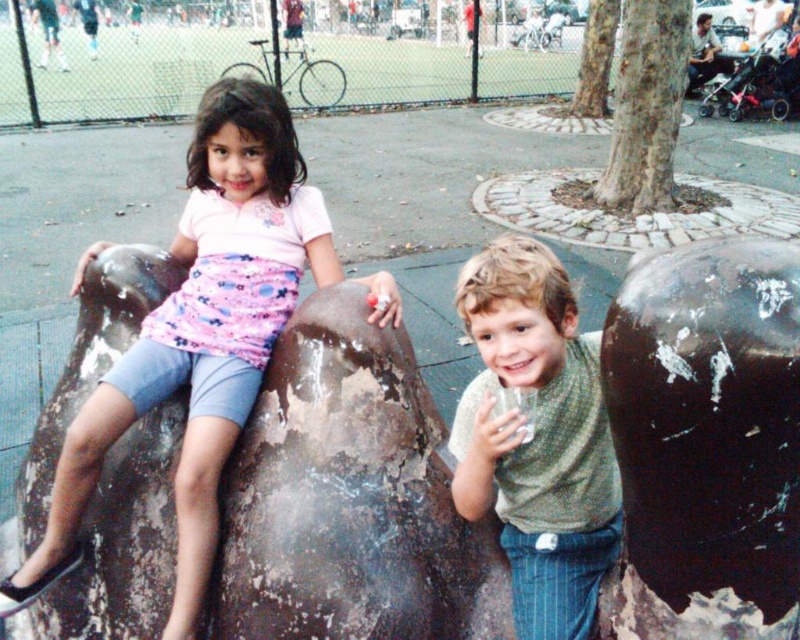
Question: Can you confirm if rusty metal sculpture at center is smaller than matte pink shirt at upper left?

Choices:
 (A) no
 (B) yes

Answer: (B)

Question: Considering the relative positions of matte pink shirt at upper left and green textured shirt at center in the image provided, where is matte pink shirt at upper left located with respect to green textured shirt at center?

Choices:
 (A) above
 (B) below

Answer: (A)

Question: Is rusty metal sculpture at center thinner than rusty metal sculpture at lower right?

Choices:
 (A) yes
 (B) no

Answer: (B)

Question: Which of the following is the closest to the observer?

Choices:
 (A) (612, 481)
 (B) (654, 531)
 (C) (158, 314)

Answer: (B)

Question: Which object is the farthest from the rusty metal sculpture at lower right?

Choices:
 (A) green textured shirt at center
 (B) matte pink shirt at upper left

Answer: (B)

Question: Which is nearer to the rusty metal sculpture at center?

Choices:
 (A) green textured shirt at center
 (B) matte pink shirt at upper left

Answer: (B)